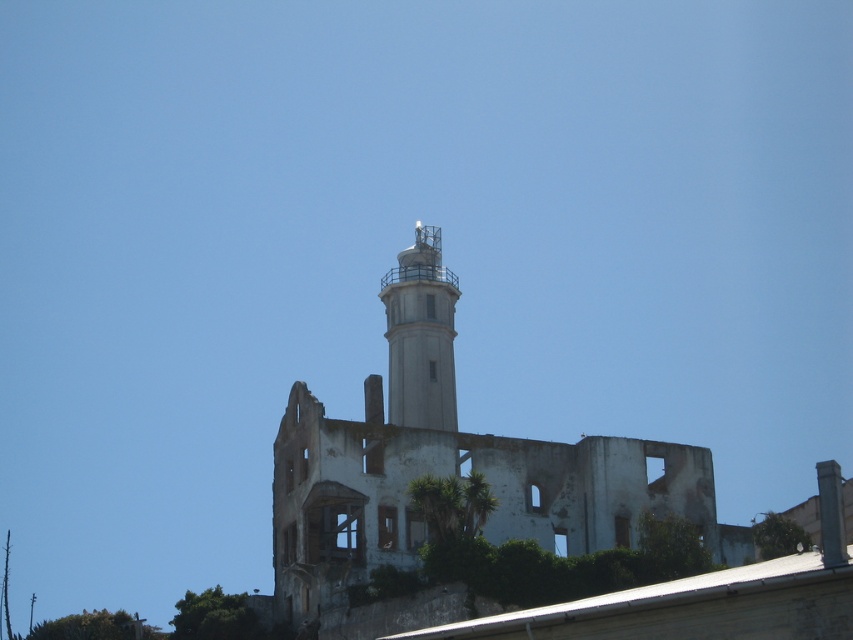
Question: Is white weathered concrete ruins at center above white concrete tower at center?

Choices:
 (A) no
 (B) yes

Answer: (A)

Question: Where is white weathered concrete ruins at center located in relation to white concrete tower at center in the image?

Choices:
 (A) right
 (B) left

Answer: (A)

Question: Which point is closer to the camera?

Choices:
 (A) (357, 440)
 (B) (418, 260)

Answer: (A)

Question: Which object appears farthest from the camera in this image?

Choices:
 (A) white concrete tower at center
 (B) white weathered concrete ruins at center

Answer: (A)

Question: Where is white weathered concrete ruins at center located in relation to white concrete tower at center in the image?

Choices:
 (A) right
 (B) left

Answer: (A)

Question: Among these objects, which one is nearest to the camera?

Choices:
 (A) white weathered concrete ruins at center
 (B) white concrete tower at center

Answer: (A)